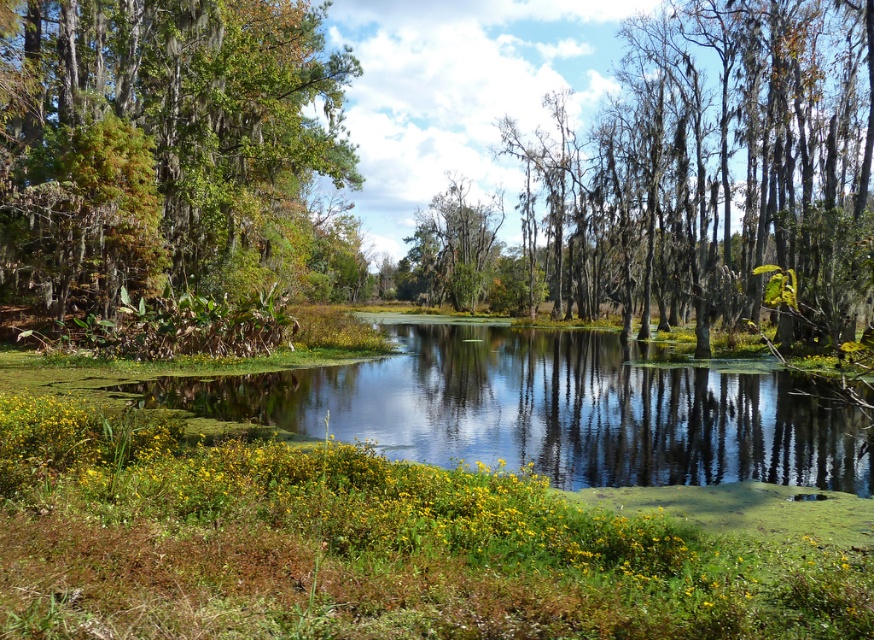
You are navigating a small boat through the swamp and need to avoid obstacles. Can you determine the position of the green mossy tree at upper left relative to your current location near the center of the water?

The green mossy tree at upper left is located at point coordinates approximately 0.227 along the horizontal axis and 0.185 along the vertical axis, meaning it is positioned to the upper left relative to your current location near the center of the water.

You are a wildlife photographer planning to capture a shot of both the gray mossy trees at center and the green mossy tree at upper left in the same frame. Your camera has a maximum zoom range of 50 meters. Can you fit both trees into your camera frame without moving your position?

The gray mossy trees at center and green mossy tree at upper left are 23.25 meters apart from each other. Since your camera can zoom up to 50 meters, which is more than the distance between them, you can fit both trees into your camera frame without moving your position.

You are a photographer trying to capture a wide shot of the gray mossy trees at center and the green mossy tree at center in the swamp scene. Given their sizes, which tree would appear more prominent in the photo?

The gray mossy trees at center would appear more prominent in the photo because their width is larger than the green mossy tree at center.